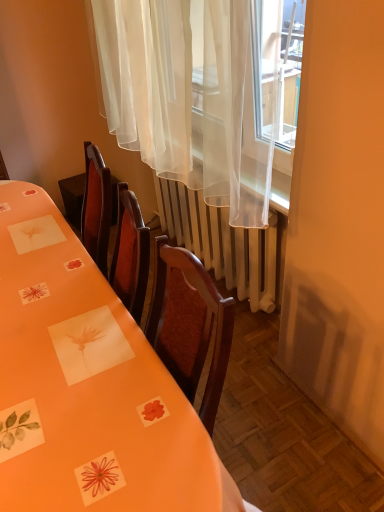
Question: From a real-world perspective, does orange paper table at center sit lower than white metallic radiator at center?

Choices:
 (A) no
 (B) yes

Answer: (A)

Question: Can white metallic radiator at center be found inside orange paper table at center?

Choices:
 (A) no
 (B) yes

Answer: (A)

Question: Can you confirm if orange paper table at center is taller than white metallic radiator at center?

Choices:
 (A) no
 (B) yes

Answer: (B)

Question: Can you confirm if orange paper table at center is shorter than white metallic radiator at center?

Choices:
 (A) no
 (B) yes

Answer: (A)

Question: Does orange paper table at center have a lesser width compared to white metallic radiator at center?

Choices:
 (A) yes
 (B) no

Answer: (B)

Question: From a real-world perspective, is orange paper table at center positioned over white metallic radiator at center based on gravity?

Choices:
 (A) yes
 (B) no

Answer: (A)

Question: Is sheer white curtain at upper center at the back of white metallic radiator at center?

Choices:
 (A) yes
 (B) no

Answer: (B)

Question: Is white metallic radiator at center in contact with sheer white curtain at upper center?

Choices:
 (A) yes
 (B) no

Answer: (B)

Question: Does white metallic radiator at center have a greater height compared to sheer white curtain at upper center?

Choices:
 (A) yes
 (B) no

Answer: (B)

Question: From a real-world perspective, does white metallic radiator at center stand above sheer white curtain at upper center?

Choices:
 (A) no
 (B) yes

Answer: (A)

Question: Is white metallic radiator at center wider than sheer white curtain at upper center?

Choices:
 (A) yes
 (B) no

Answer: (B)

Question: Is sheer white curtain at upper center inside white metallic radiator at center?

Choices:
 (A) no
 (B) yes

Answer: (A)

Question: Can orange paper table at center be found inside white metallic radiator at center?

Choices:
 (A) no
 (B) yes

Answer: (A)